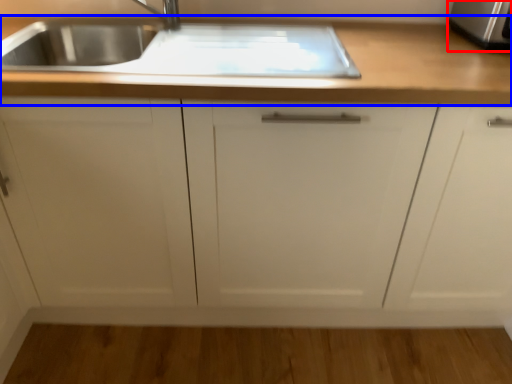
Question: Which point is further to the camera, stainless steel (highlighted by a red box) or countertop (highlighted by a blue box)?

Choices:
 (A) stainless steel
 (B) countertop

Answer: (A)